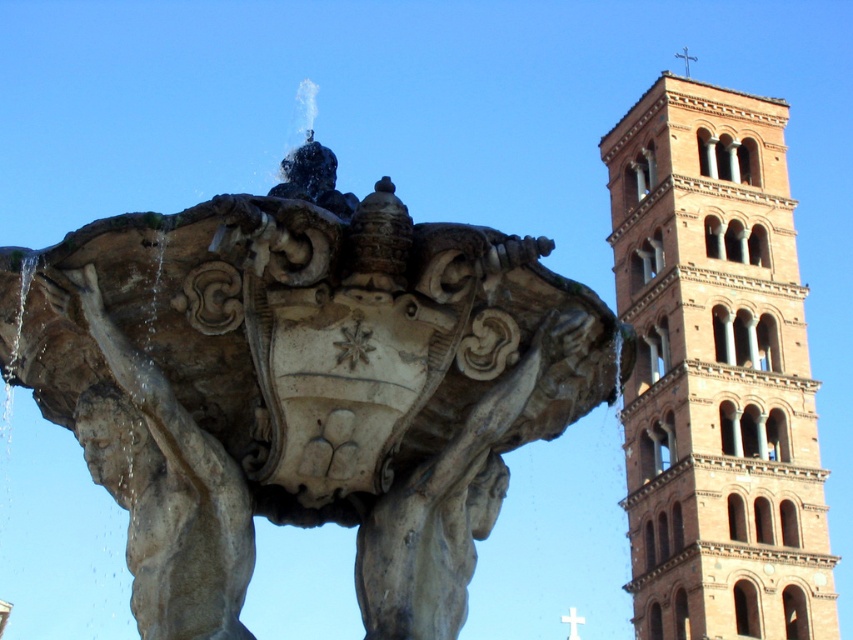
Question: From the image, what is the correct spatial relationship of stone fountain at center in relation to terracotta brick tower at right?

Choices:
 (A) below
 (B) above

Answer: (B)

Question: Is stone fountain at center smaller than terracotta brick tower at right?

Choices:
 (A) yes
 (B) no

Answer: (A)

Question: Among these points, which one is nearest to the camera?

Choices:
 (A) (x=152, y=604)
 (B) (x=672, y=360)

Answer: (A)

Question: Is stone fountain at center positioned before terracotta brick tower at right?

Choices:
 (A) yes
 (B) no

Answer: (A)

Question: Which point appears closest to the camera in this image?

Choices:
 (A) pos(428,380)
 (B) pos(764,396)

Answer: (A)